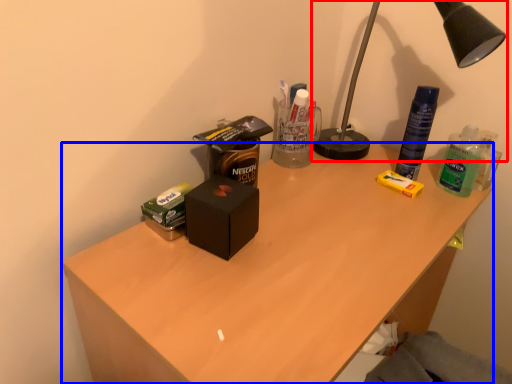
Question: Which of the following is the closest to the observer, lamp (highlighted by a red box) or desk (highlighted by a blue box)?

Choices:
 (A) lamp
 (B) desk

Answer: (B)